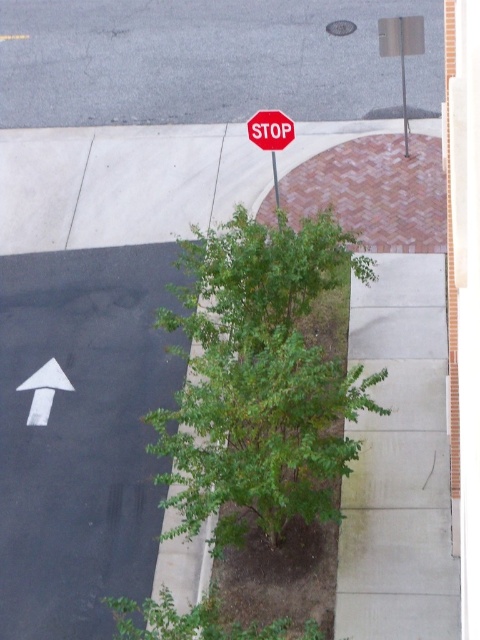
Question: Which object is closer to the camera taking this photo?

Choices:
 (A) metallic pole at center
 (B) red matte stop sign at upper center

Answer: (B)

Question: Where is red matte stop sign at upper center located in relation to metallic pole at center in the image?

Choices:
 (A) below
 (B) above

Answer: (B)

Question: Which of the following is the farthest from the observer?

Choices:
 (A) green leafy tree at center
 (B) metallic pole at center

Answer: (B)

Question: Does green leafy tree at center appear under metallic pole at center?

Choices:
 (A) yes
 (B) no

Answer: (A)

Question: Does red matte stop sign at upper center have a lesser width compared to metallic pole at center?

Choices:
 (A) yes
 (B) no

Answer: (B)

Question: Among these objects, which one is nearest to the camera?

Choices:
 (A) metallic pole at center
 (B) green leafy tree at center
 (C) red matte stop sign at upper center

Answer: (B)